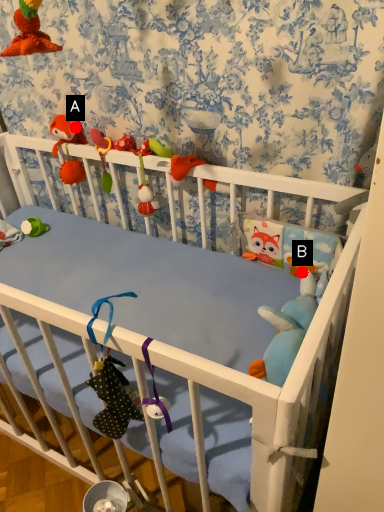
Question: Two points are circled on the image, labeled by A and B beside each circle. Among these points, which one is nearest to the camera?

Choices:
 (A) A is closer
 (B) B is closer

Answer: (B)